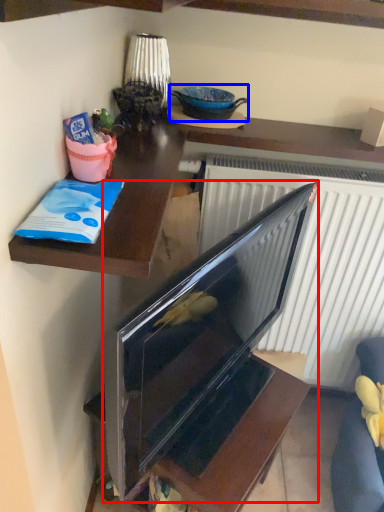
Question: Among these objects, which one is nearest to the camera, television (highlighted by a red box) or appliance (highlighted by a blue box)?

Choices:
 (A) television
 (B) appliance

Answer: (A)